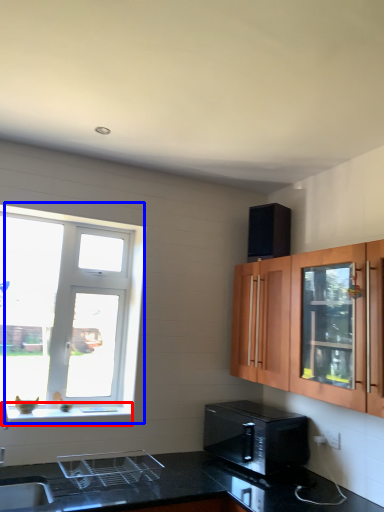
Question: Which object appears farthest to the camera in this image, window sill (highlighted by a red box) or window (highlighted by a blue box)?

Choices:
 (A) window sill
 (B) window

Answer: (B)